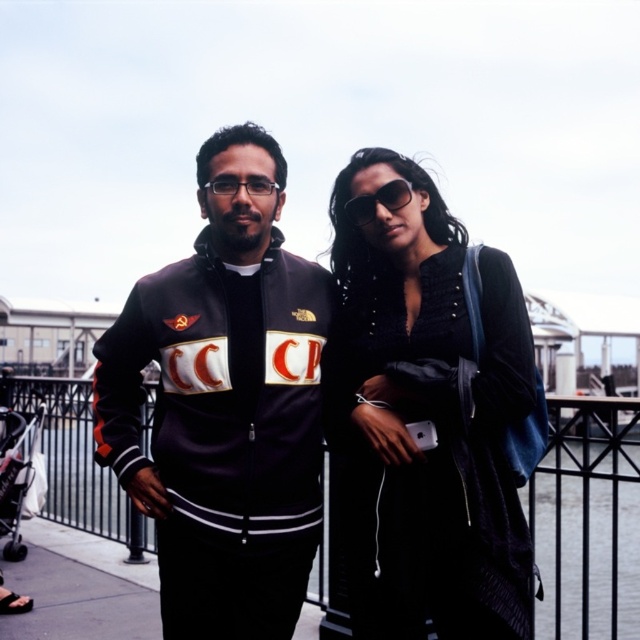
You are a photographer trying to capture a candid shot of the two people without them noticing. You have a camera with a zoom lens. Given the black metal fence at center and sunglasses at center, which object would block your view more if positioned between you and the subjects?

The black metal fence at center is larger in size than sunglasses at center, so it would block your view more if positioned between you and the subjects.

You are a photographer trying to capture a clear shot of the black velvet dress at center without the black metal fence at center obstructing it. What adjustment should you make to your camera angle?

Since the black velvet dress at center is positioned over the black metal fence at center, you should adjust your camera angle to aim slightly downward to frame the dress while avoiding the fence behind it.

You are a photographer wanting to capture both the black velvet dress at center and the black metal fence at center in the same frame. Based on their positions, which object should you adjust your camera to focus on first to ensure both are in the shot?

Since the black velvet dress at center is to the right of the black metal fence at center, you should focus on the black metal fence at center first as it is closer to the left side, allowing the camera to capture both objects in the frame.